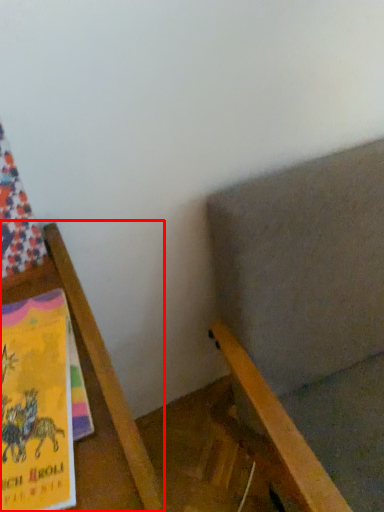
Question: From the image's perspective, considering the relative positions of furniture (annotated by the red box) and chair in the image provided, where is furniture (annotated by the red box) located with respect to the staircase?

Choices:
 (A) above
 (B) below

Answer: (B)